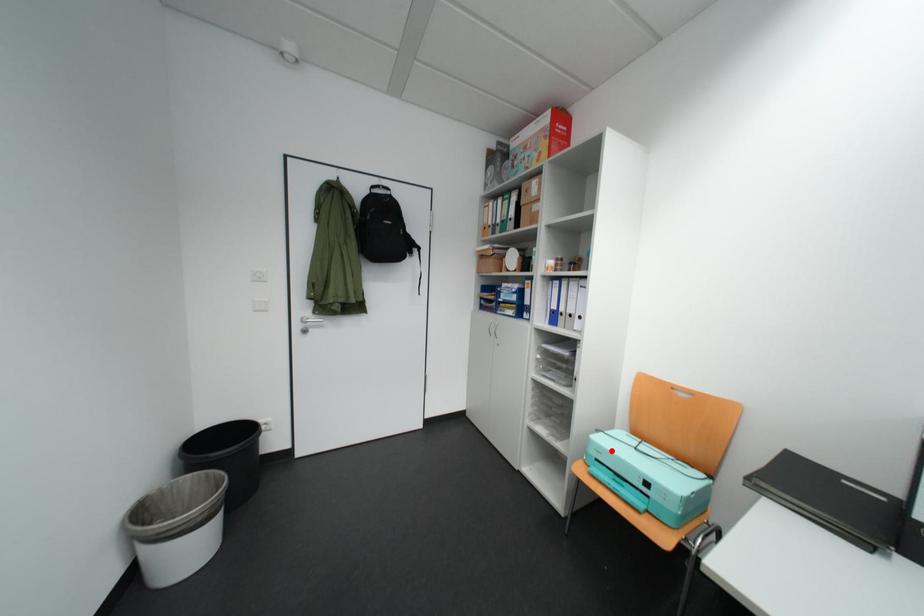
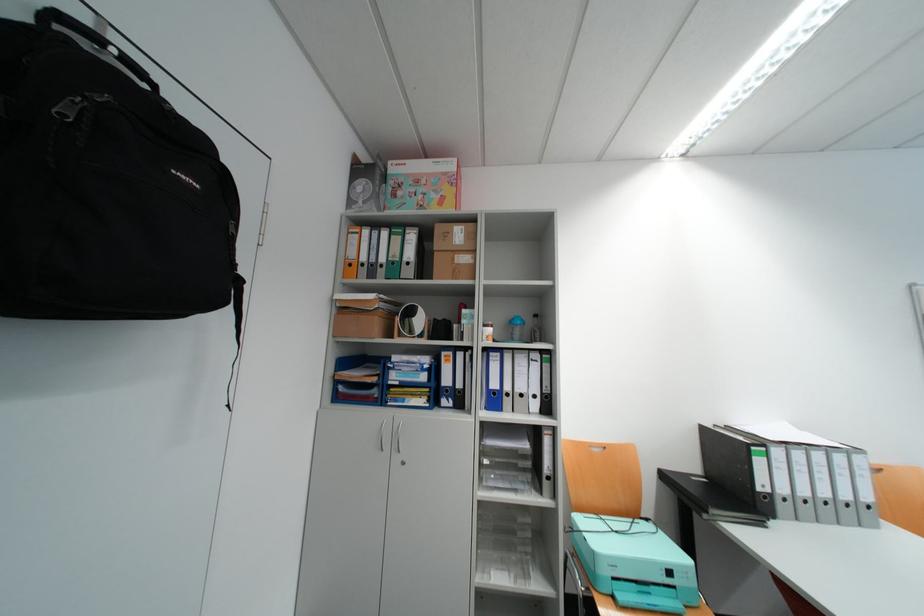
In the second image, find the point that corresponds to the highlighted location in the first image.

(624, 562)